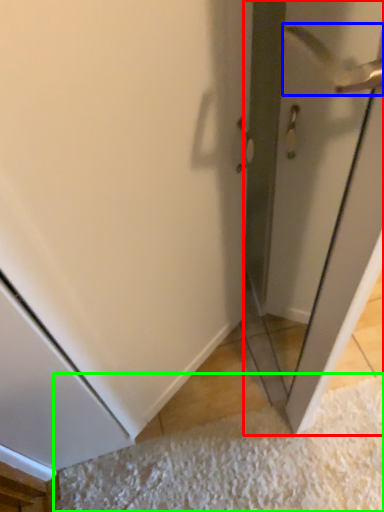
Question: Which object is positioned closest to screen door (highlighted by a red box)? Select from door handle (highlighted by a blue box) and doormat (highlighted by a green box).

Choices:
 (A) door handle
 (B) doormat

Answer: (A)